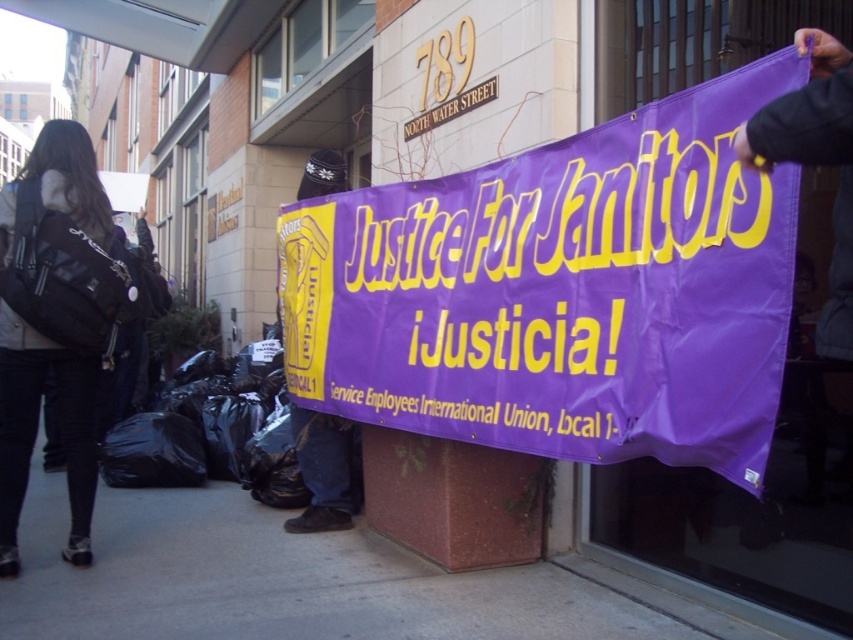
Question: Can you confirm if purple fabric banner at center is positioned below black fabric backpack at left?

Choices:
 (A) yes
 (B) no

Answer: (B)

Question: Can you confirm if purple fabric banner at center is positioned above black fabric backpack at left?

Choices:
 (A) no
 (B) yes

Answer: (B)

Question: Which object is positioned farthest from the purple fabric banner at center?

Choices:
 (A) black fabric backpack at left
 (B) purple fabric banner at lower center

Answer: (A)

Question: Among these objects, which one is farthest from the camera?

Choices:
 (A) purple fabric banner at lower center
 (B) purple fabric banner at center

Answer: (A)

Question: Which of the following is the closest to the observer?

Choices:
 (A) purple fabric banner at lower center
 (B) black fabric backpack at left
 (C) purple fabric banner at center

Answer: (C)

Question: Is the position of purple fabric banner at center more distant than that of black fabric backpack at left?

Choices:
 (A) no
 (B) yes

Answer: (A)